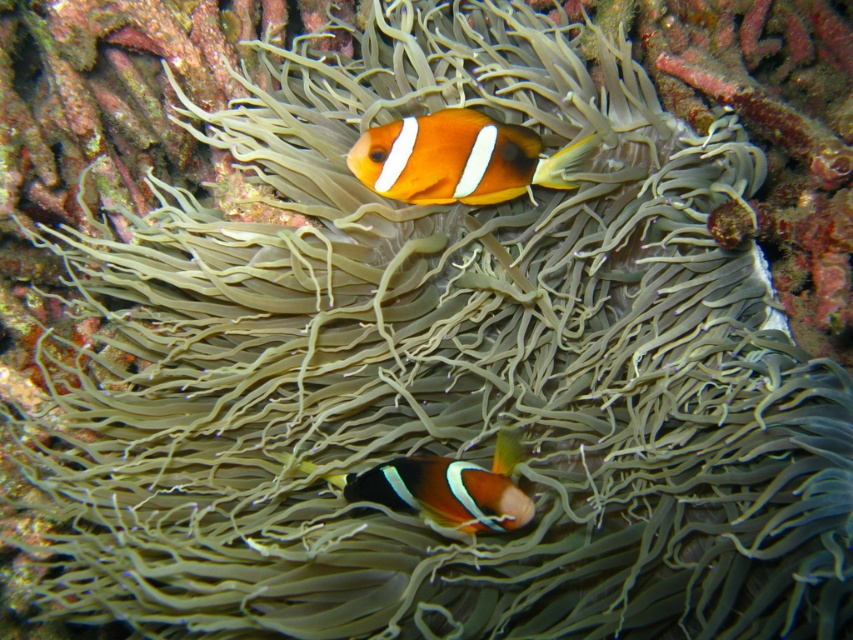
Is point (502, 193) positioned after point (486, 477)?

Yes, it is.

The width and height of the screenshot is (853, 640). What are the coordinates of `orange matte clownfish at upper center` in the screenshot? It's located at (459, 157).